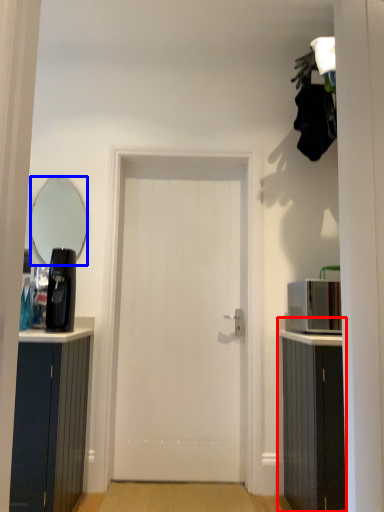
Question: Which point is closer to the camera, cabinetry (highlighted by a red box) or mirror (highlighted by a blue box)?

Choices:
 (A) cabinetry
 (B) mirror

Answer: (A)